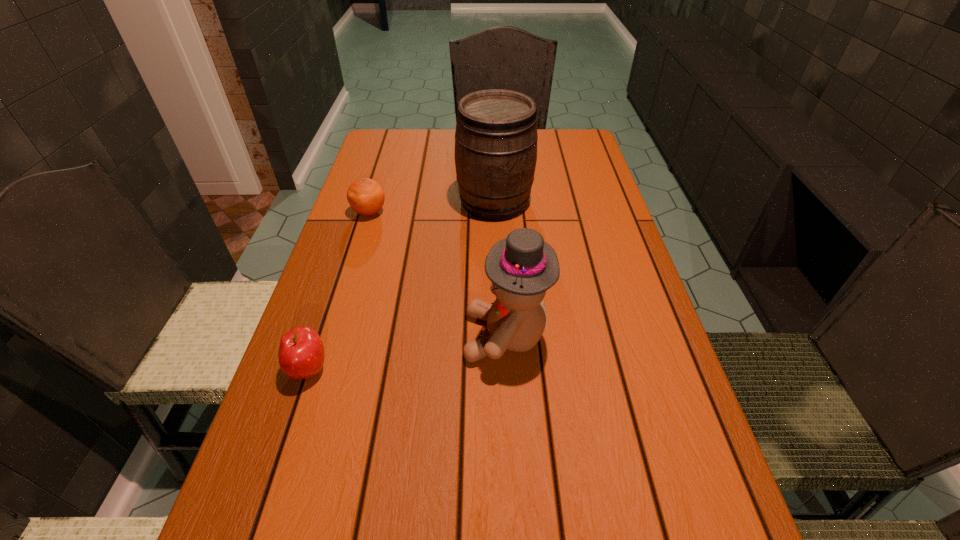
Identify the location of free space between the wine bucket and the apple. This screenshot has width=960, height=540. (401, 285).

Identify the location of vacant space that's between the wine bucket and the orange. (432, 207).

The width and height of the screenshot is (960, 540). In order to click on free space between the apple and the rag_doll in this screenshot , I will do `click(407, 353)`.

Locate an element on the screen. The height and width of the screenshot is (540, 960). free space between the orange and the rag_doll is located at coordinates (438, 274).

At what (x,y) coordinates should I click in order to perform the action: click on free spot between the apple and the rag_doll. Please return your answer as a coordinate pair (x, y). The image size is (960, 540). Looking at the image, I should click on coord(407,353).

Image resolution: width=960 pixels, height=540 pixels. I want to click on free space between the rag_doll and the apple, so click(x=407, y=353).

Locate which object ranks second in proximity to the wine bucket. Please provide its 2D coordinates. Your answer should be formatted as a tuple, i.e. [(x, y)], where the tuple contains the x and y coordinates of a point satisfying the conditions above.

[(521, 267)]

Identify the location of the closest object to the orange. This screenshot has width=960, height=540. (496, 136).

Where is `free spot that satisfies the following two spatial constraints: 1. on the back side of the orange; 2. on the left side of the wine bucket`? The image size is (960, 540). free spot that satisfies the following two spatial constraints: 1. on the back side of the orange; 2. on the left side of the wine bucket is located at coordinates (372, 201).